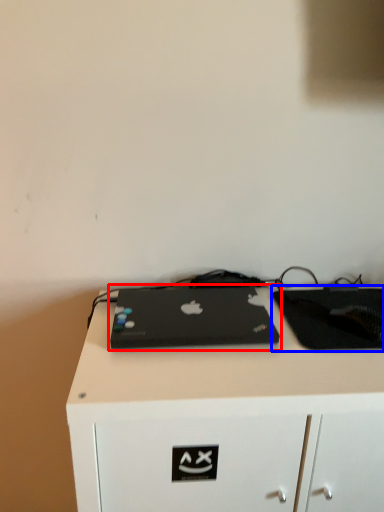
Question: Which of the following is the closest to the observer, laptop (highlighted by a red box) or tablet computer (highlighted by a blue box)?

Choices:
 (A) laptop
 (B) tablet computer

Answer: (A)